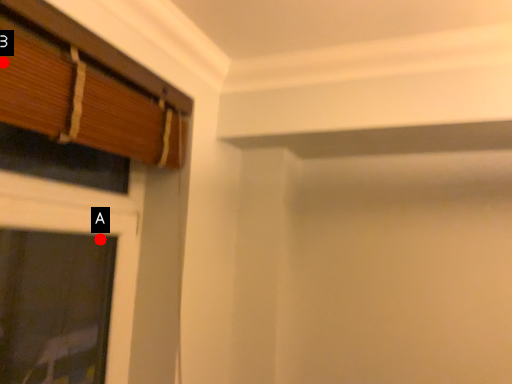
Question: Two points are circled on the image, labeled by A and B beside each circle. Which point appears farthest from the camera in this image?

Choices:
 (A) A is further
 (B) B is further

Answer: (A)